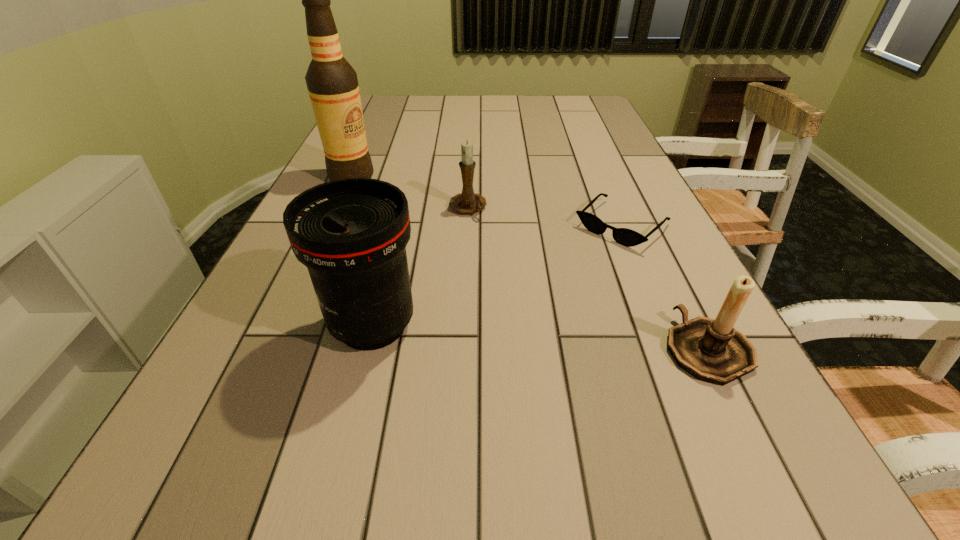
What are the coordinates of `free location located 0.140m on the label of the leftmost object` in the screenshot? It's located at (381, 210).

Where is `blank area located on the label of the leftmost object`? The width and height of the screenshot is (960, 540). blank area located on the label of the leftmost object is located at coordinates (389, 219).

Identify the location of free space located on the label of the leftmost object. This screenshot has width=960, height=540. (384, 213).

The height and width of the screenshot is (540, 960). In order to click on vacant space located on the side of the left candle holder with the handle in this screenshot , I will do `click(540, 304)`.

Find the location of a particular element. free point located on the side of the left candle holder with the handle is located at coordinates (529, 288).

The width and height of the screenshot is (960, 540). I want to click on vacant space situated 0.240m on the side of the left candle holder with the handle, so click(x=521, y=279).

The image size is (960, 540). What are the coordinates of `vacant region located on the front-facing side of the shortest object` in the screenshot? It's located at pyautogui.click(x=546, y=296).

The width and height of the screenshot is (960, 540). Find the location of `free region located 0.150m on the front-facing side of the shortest object`. free region located 0.150m on the front-facing side of the shortest object is located at coordinates (563, 281).

At what (x,y) coordinates should I click in order to perform the action: click on vacant area located 0.070m on the front-facing side of the shortest object. Please return your answer as a coordinate pair (x, y). Looking at the image, I should click on (582, 262).

You are a GUI agent. You are given a task and a screenshot of the screen. Output one action in this format:
    pyautogui.click(x=<x>, y=<y>)
    Task: Click on the object that is at the left edge
    This screenshot has height=540, width=960.
    Given the screenshot: What is the action you would take?
    pyautogui.click(x=332, y=83)